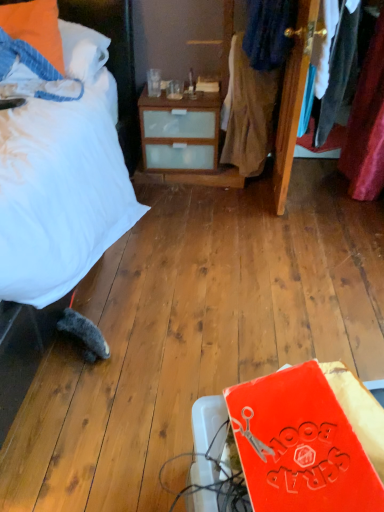
Question: Considering the relative positions of orange fabric pillow at upper left and rubberized orange book at lower right in the image provided, is orange fabric pillow at upper left to the left of rubberized orange book at lower right from the viewer's perspective?

Choices:
 (A) yes
 (B) no

Answer: (A)

Question: Is orange fabric pillow at upper left thinner than rubberized orange book at lower right?

Choices:
 (A) yes
 (B) no

Answer: (B)

Question: From the image's perspective, would you say orange fabric pillow at upper left is positioned over rubberized orange book at lower right?

Choices:
 (A) no
 (B) yes

Answer: (B)

Question: Is orange fabric pillow at upper left positioned beyond the bounds of rubberized orange book at lower right?

Choices:
 (A) no
 (B) yes

Answer: (B)

Question: Is orange fabric pillow at upper left at the right side of rubberized orange book at lower right?

Choices:
 (A) no
 (B) yes

Answer: (A)

Question: Considering the relative sizes of orange fabric pillow at upper left and rubberized orange book at lower right in the image provided, is orange fabric pillow at upper left shorter than rubberized orange book at lower right?

Choices:
 (A) yes
 (B) no

Answer: (B)

Question: Considering the relative positions of white soft bed at left and denim jacket at upper right, which is the first clothing from top to bottom, in the image provided, is white soft bed at left to the right of denim jacket at upper right, which is the first clothing from top to bottom, from the viewer's perspective?

Choices:
 (A) yes
 (B) no

Answer: (B)

Question: From a real-world perspective, is white soft bed at left under denim jacket at upper right, which is the first clothing from top to bottom?

Choices:
 (A) no
 (B) yes

Answer: (B)

Question: Can you confirm if white soft bed at left is positioned to the left of denim jacket at upper right, which is the first clothing from top to bottom?

Choices:
 (A) yes
 (B) no

Answer: (A)

Question: Would you say white soft bed at left contains denim jacket at upper right, acting as the 2th clothing starting from the bottom?

Choices:
 (A) no
 (B) yes

Answer: (A)

Question: Can you confirm if white soft bed at left is bigger than denim jacket at upper right, which is the first clothing from top to bottom?

Choices:
 (A) yes
 (B) no

Answer: (A)

Question: Is the position of white soft bed at left more distant than that of denim jacket at upper right, acting as the 2th clothing starting from the bottom?

Choices:
 (A) no
 (B) yes

Answer: (A)

Question: Is orange fabric pillow at upper left at the back of denim jacket at upper right, which is the first clothing from top to bottom?

Choices:
 (A) no
 (B) yes

Answer: (A)